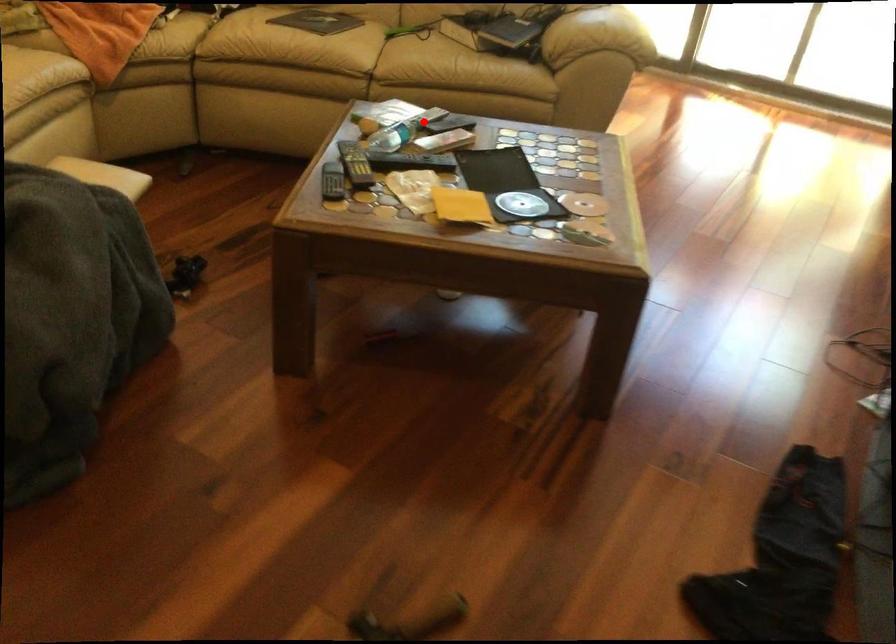
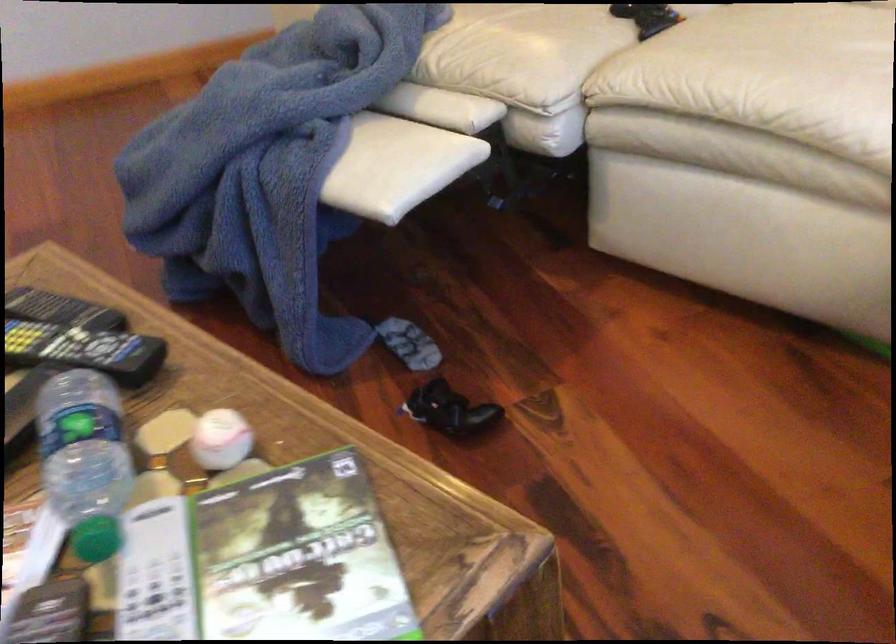
Question: I am providing you with two images of the same scene from different viewpoints. In image1, a red point is highlighted. Considering the same 3D point in image2, which of the following is correct?

Choices:
 (A) It is closer
 (B) It is farther

Answer: (A)